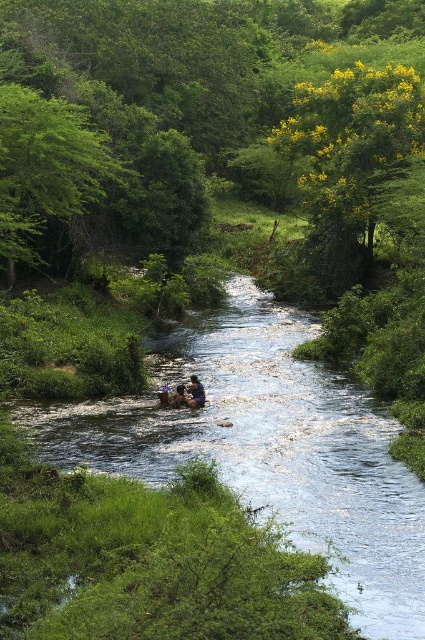
Question: Is brown leather boat at center thinner than brown leather jacket at center?

Choices:
 (A) no
 (B) yes

Answer: (A)

Question: Which point appears farthest from the camera in this image?

Choices:
 (A) (82, 125)
 (B) (189, 445)

Answer: (A)

Question: Which point appears closest to the camera in this image?

Choices:
 (A) (210, 22)
 (B) (184, 392)

Answer: (B)

Question: Can you confirm if green leafy tree at center is bigger than brown leather boat at center?

Choices:
 (A) yes
 (B) no

Answer: (A)

Question: Does yellow-green leaves at upper right appear on the left side of brown leather boat at center?

Choices:
 (A) no
 (B) yes

Answer: (A)

Question: Which of the following is the closest to the observer?

Choices:
 (A) green leafy tree at upper left
 (B) yellow-green leaves at upper right
 (C) brown leather jacket at center

Answer: (C)